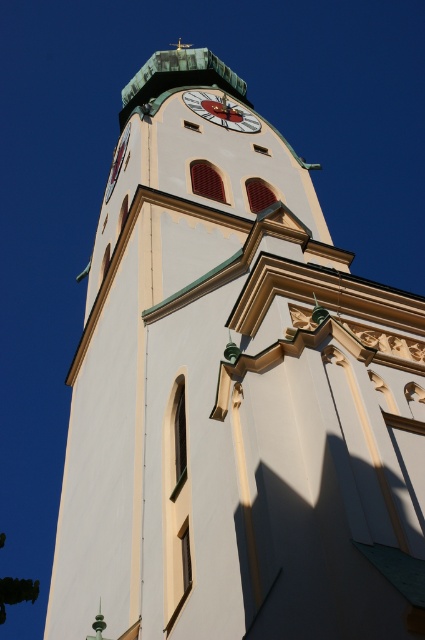
You are standing at the base of the church tower and want to know how far you are from the point marked at coordinates point (x=218, y=118). Can you determine the distance?

The distance between the viewer and point (x=218, y=118) is 88.87 meters.

You are standing at the base of the church tower and looking up at the two points marked on the tower. Which point, point [207,113] or point [116,164], is closer to your eyes?

Point [207,113] is in front of point [116,164], so it is closer to your eyes.